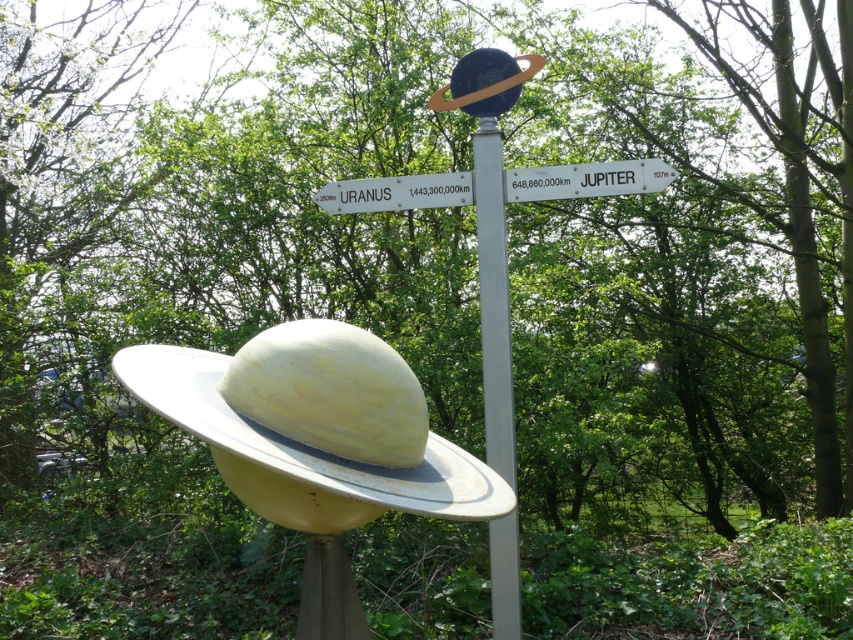
Question: Is matte yellow hat at center thinner than white plastic sign at upper right?

Choices:
 (A) no
 (B) yes

Answer: (A)

Question: Which of the following is the closest to the observer?

Choices:
 (A) white plastic sign at upper center
 (B) matte yellow hat at center
 (C) white plastic sign at upper right

Answer: (B)

Question: Can you confirm if white plastic pole at center is positioned above white plastic sign at upper center?

Choices:
 (A) no
 (B) yes

Answer: (A)

Question: Among these objects, which one is nearest to the camera?

Choices:
 (A) white plastic sign at upper right
 (B) white plastic sign at upper center
 (C) matte yellow hat at center

Answer: (C)

Question: Which of the following is the farthest from the observer?

Choices:
 (A) (258, 413)
 (B) (451, 189)

Answer: (B)

Question: Can you confirm if matte yellow hat at center is positioned below white plastic sign at upper center?

Choices:
 (A) yes
 (B) no

Answer: (A)